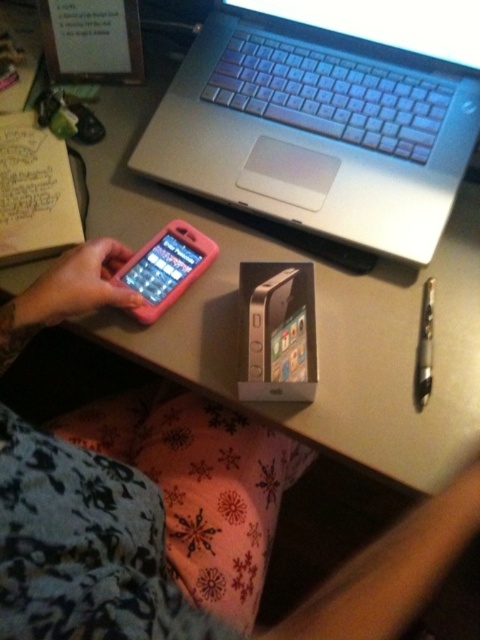
Which is in front, point (278, 348) or point (419, 381)?

Point (278, 348) is in front.

Who is lower down, silver metallic ipod at center or metallic pen at right?

Positioned lower is metallic pen at right.

Measure the distance between silver metallic ipod at center and camera.

They are 23.93 inches apart.

Find the location of a particular element. silver metallic ipod at center is located at coordinates (276, 332).

Which is more to the right, pink matte phone at center or pink matte smartphone at center?

pink matte phone at center

Does pink matte phone at center have a greater width compared to pink matte smartphone at center?

Indeed, pink matte phone at center has a greater width compared to pink matte smartphone at center.

The height and width of the screenshot is (640, 480). Identify the location of pink matte phone at center. (132, 532).

This screenshot has width=480, height=640. I want to click on pink matte phone at center, so pyautogui.click(x=132, y=532).

Can you confirm if pink matte phone at center is positioned above silver metallic ipod at center?

Actually, pink matte phone at center is below silver metallic ipod at center.

Does point (81, 460) lie in front of point (284, 320)?

Yes, it is in front of point (284, 320).

Who is more forward, (117,486) or (276,288)?

Positioned in front is point (117,486).

Where is `pink matte phone at center`? Image resolution: width=480 pixels, height=640 pixels. pink matte phone at center is located at coordinates (132, 532).